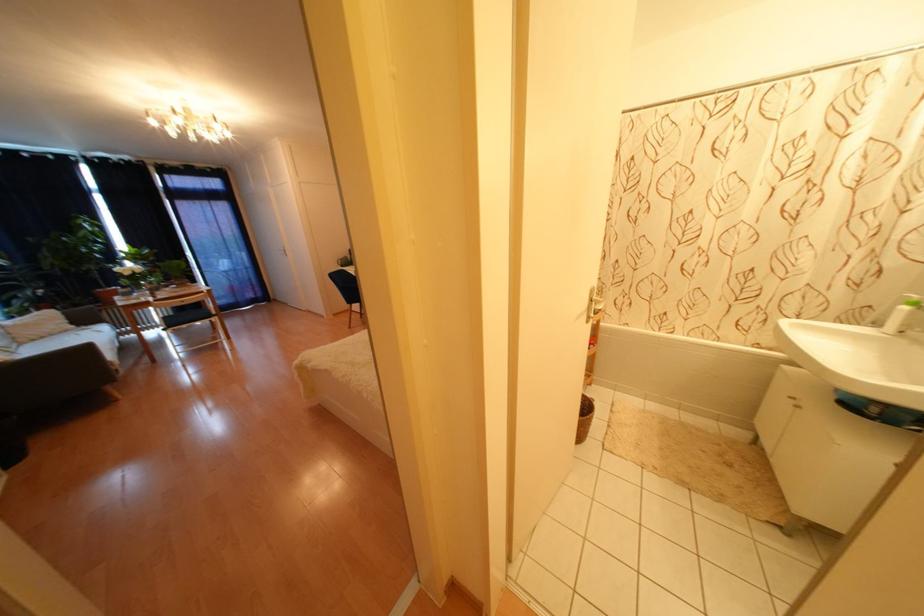
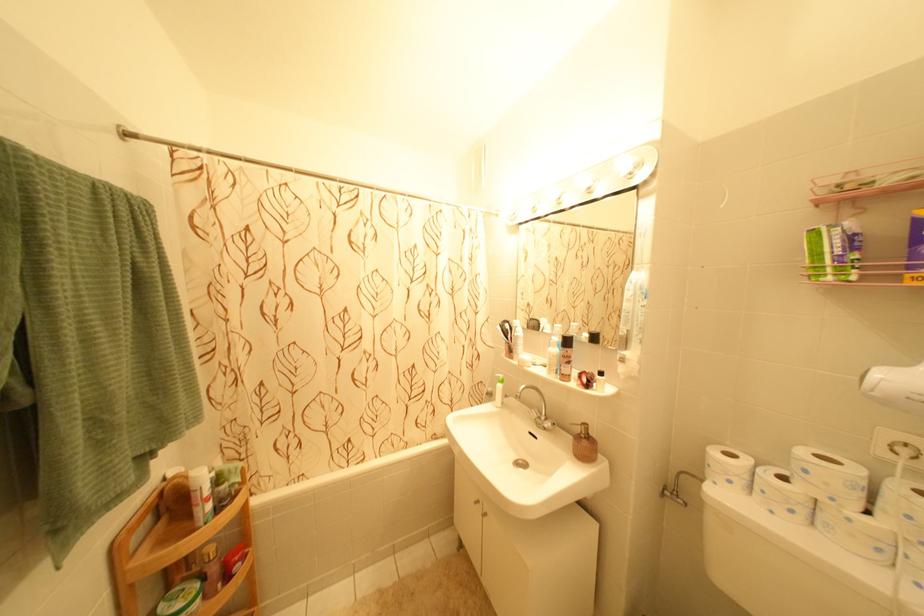
Question: How did the camera likely rotate?

Choices:
 (A) Left
 (B) Right
 (C) Up
 (D) Down

Answer: (B)